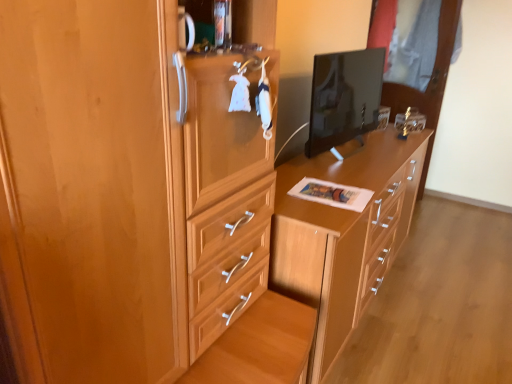
Question: Could you tell me if wooden chest of drawers at center is turned towards transparent glass door at upper right?

Choices:
 (A) no
 (B) yes

Answer: (A)

Question: Is wooden chest of drawers at center bigger than transparent glass door at upper right?

Choices:
 (A) yes
 (B) no

Answer: (A)

Question: From a real-world perspective, is wooden chest of drawers at center positioned over transparent glass door at upper right based on gravity?

Choices:
 (A) no
 (B) yes

Answer: (A)

Question: Could transparent glass door at upper right be considered to be inside wooden chest of drawers at center?

Choices:
 (A) no
 (B) yes

Answer: (A)

Question: Is wooden chest of drawers at center positioned beyond the bounds of transparent glass door at upper right?

Choices:
 (A) no
 (B) yes

Answer: (B)

Question: From a real-world perspective, is matte black monitor at center above or below matte wood cabinet at center?

Choices:
 (A) above
 (B) below

Answer: (A)

Question: In terms of width, does matte black monitor at center look wider or thinner when compared to matte wood cabinet at center?

Choices:
 (A) thin
 (B) wide

Answer: (A)

Question: Is matte black monitor at center to the left or to the right of matte wood cabinet at center in the image?

Choices:
 (A) right
 (B) left

Answer: (A)

Question: Is matte black monitor at center bigger or smaller than matte wood cabinet at center?

Choices:
 (A) big
 (B) small

Answer: (B)

Question: Is matte wood cabinet at center in front of or behind transparent glass door at upper right in the image?

Choices:
 (A) front
 (B) behind

Answer: (A)

Question: Based on their positions, is matte wood cabinet at center located to the left or right of transparent glass door at upper right?

Choices:
 (A) left
 (B) right

Answer: (A)

Question: From a real-world perspective, is matte wood cabinet at center physically located above or below transparent glass door at upper right?

Choices:
 (A) below
 (B) above

Answer: (A)

Question: Is matte wood cabinet at center inside the boundaries of transparent glass door at upper right, or outside?

Choices:
 (A) outside
 (B) inside

Answer: (A)

Question: From a real-world perspective, relative to transparent glass door at upper right, is wooden chest of drawers at center vertically above or below?

Choices:
 (A) below
 (B) above

Answer: (A)

Question: Is wooden chest of drawers at center to the left or to the right of transparent glass door at upper right in the image?

Choices:
 (A) left
 (B) right

Answer: (A)